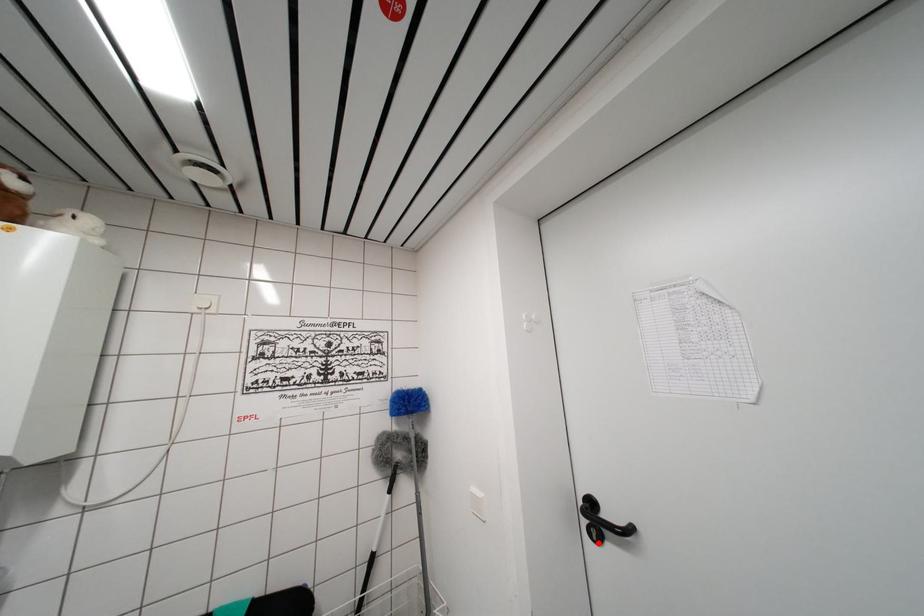
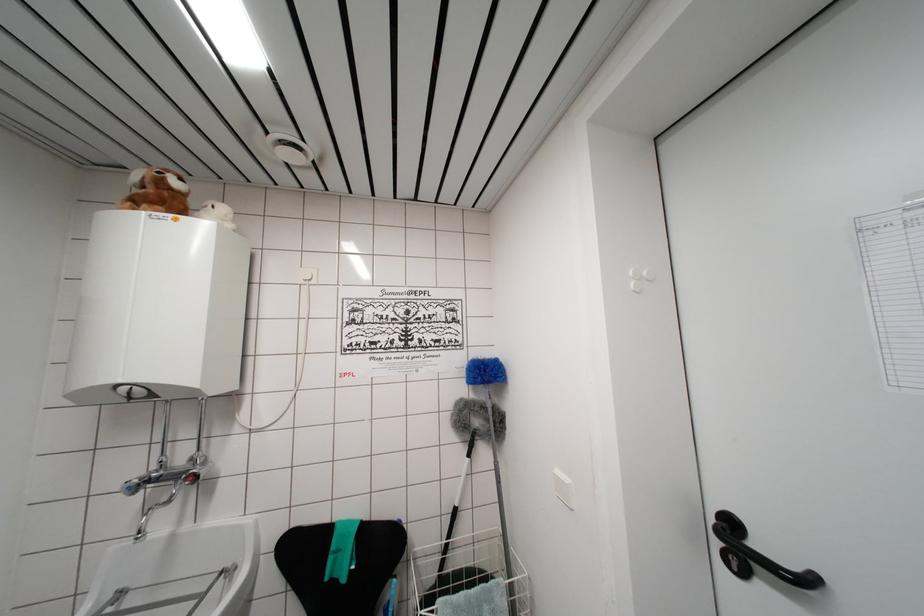
Locate, in the second image, the point that corresponds to the highlighted location in the first image.

(738, 573)